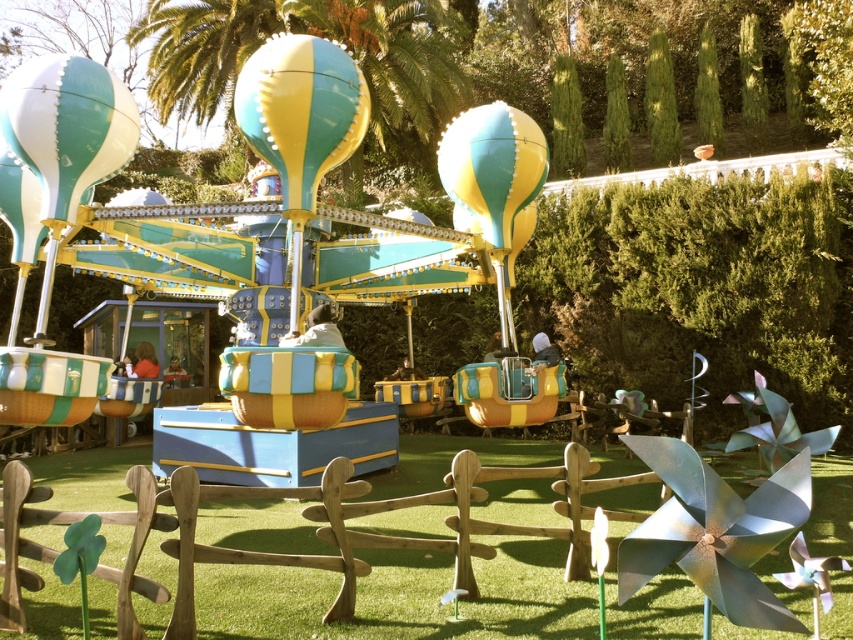
Question: Is matte yellow and blue carousel at center to the right of teal glossy hot air balloon at upper left from the viewer's perspective?

Choices:
 (A) no
 (B) yes

Answer: (B)

Question: Considering the real-world distances, which object is closest to the green artificial turf at center?

Choices:
 (A) teal glossy hot air balloon at upper left
 (B) matte plastic balloon at center
 (C) teal and yellow striped balloon at center

Answer: (C)

Question: Considering the relative positions of matte yellow and blue carousel at center and matte plastic balloon at center in the image provided, where is matte yellow and blue carousel at center located with respect to matte plastic balloon at center?

Choices:
 (A) below
 (B) above

Answer: (A)

Question: Is green artificial turf at center wider than teal and yellow striped balloon at center?

Choices:
 (A) yes
 (B) no

Answer: (B)

Question: Which of the following is the farthest from the observer?

Choices:
 (A) (207, 264)
 (B) (113, 164)
 (C) (466, 192)

Answer: (A)

Question: Which point is farther to the camera?

Choices:
 (A) teal and yellow striped balloon at center
 (B) teal glossy hot air balloon at upper left
 (C) matte yellow and blue carousel at center
 (D) green artificial turf at center

Answer: (C)